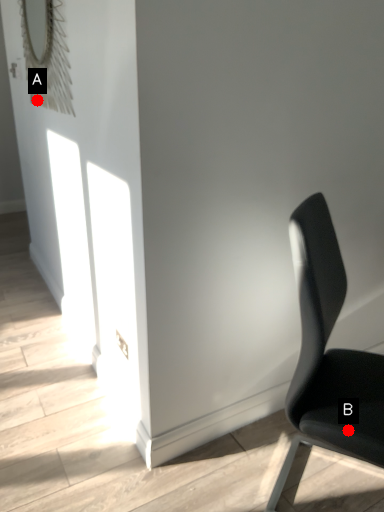
Question: Two points are circled on the image, labeled by A and B beside each circle. Among these points, which one is farthest from the camera?

Choices:
 (A) A is further
 (B) B is further

Answer: (A)